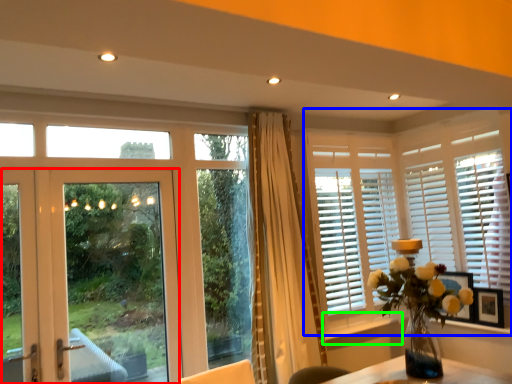
Question: Which is nearer to the door (highlighted by a red box)? window (highlighted by a blue box) or window sill (highlighted by a green box).

Choices:
 (A) window
 (B) window sill

Answer: (B)